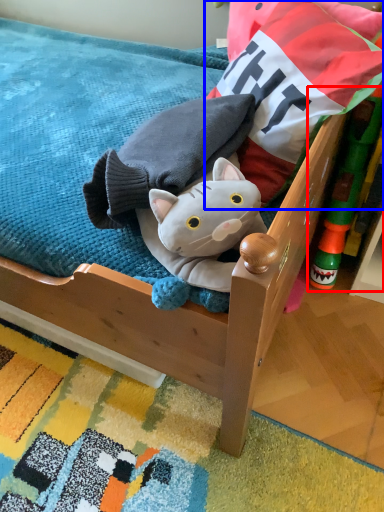
Question: Which object is further to the camera taking this photo, toy (highlighted by a red box) or pillow (highlighted by a blue box)?

Choices:
 (A) toy
 (B) pillow

Answer: (A)